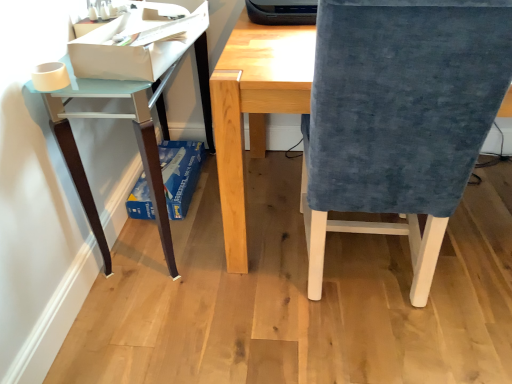
This screenshot has width=512, height=384. In order to click on vacant space situated on the left part of velvet blue chair at right in this screenshot , I will do `click(227, 306)`.